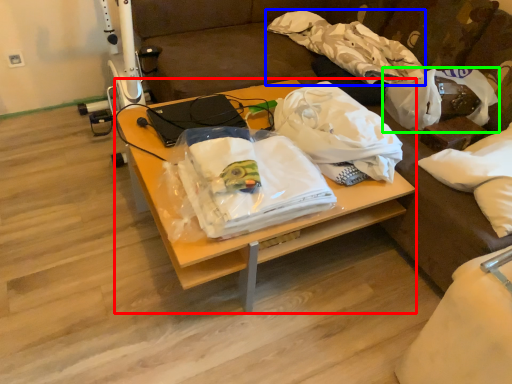
Question: Which is nearer to the desk (highlighted by a red box)? cloth (highlighted by a blue box) or plastic bag (highlighted by a green box).

Choices:
 (A) cloth
 (B) plastic bag

Answer: (B)